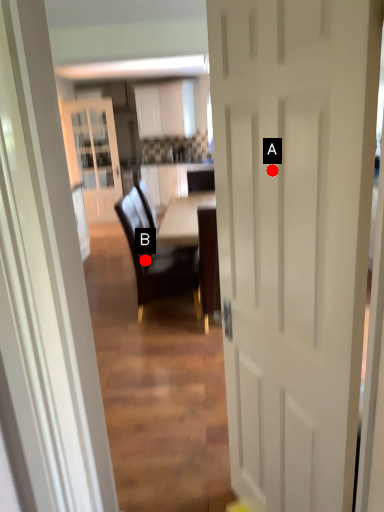
Question: Two points are circled on the image, labeled by A and B beside each circle. Which point appears closest to the camera in this image?

Choices:
 (A) A is closer
 (B) B is closer

Answer: (A)